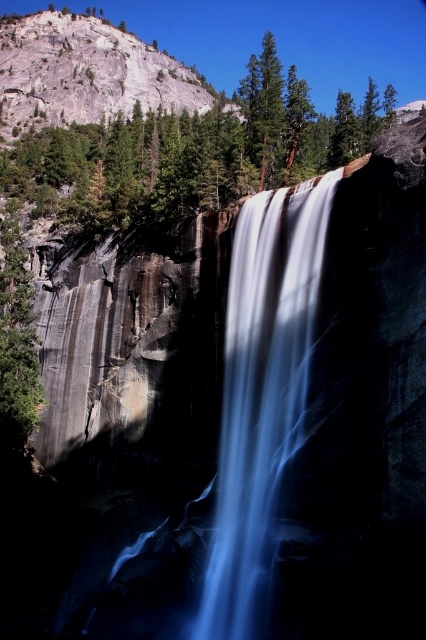
Question: Which object is positioned closest to the green rough bark tree at left?

Choices:
 (A) blue translucent water at center
 (B) green textured tree at center

Answer: (A)

Question: Can you confirm if green textured tree at center is bigger than blue translucent water at center?

Choices:
 (A) no
 (B) yes

Answer: (B)

Question: Which of these objects is positioned farthest from the blue translucent water at center?

Choices:
 (A) green rough bark tree at left
 (B) green textured tree at center

Answer: (B)

Question: Is blue translucent water at center behind green rough bark tree at left?

Choices:
 (A) no
 (B) yes

Answer: (A)

Question: Does blue translucent water at center have a smaller size compared to green rough bark tree at left?

Choices:
 (A) yes
 (B) no

Answer: (B)

Question: Which point appears farthest from the camera in this image?

Choices:
 (A) (224, 525)
 (B) (86, 225)

Answer: (B)